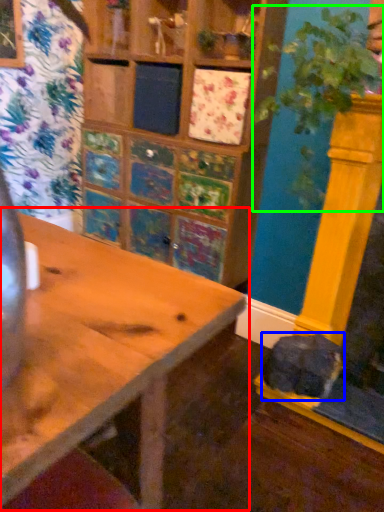
Question: Which object is the farthest from table (highlighted by a red box)? Choose among these: animal (highlighted by a blue box) or plant (highlighted by a green box).

Choices:
 (A) animal
 (B) plant

Answer: (A)